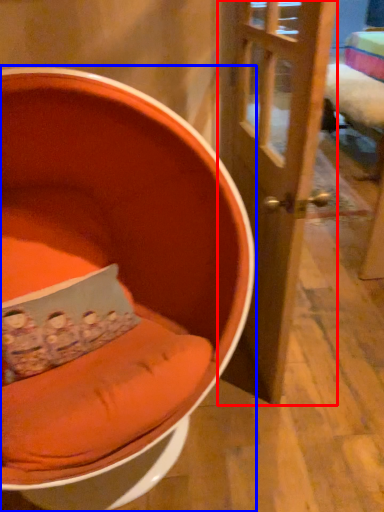
Question: Which of the following is the farthest to the observer, door (highlighted by a red box) or chair (highlighted by a blue box)?

Choices:
 (A) door
 (B) chair

Answer: (A)